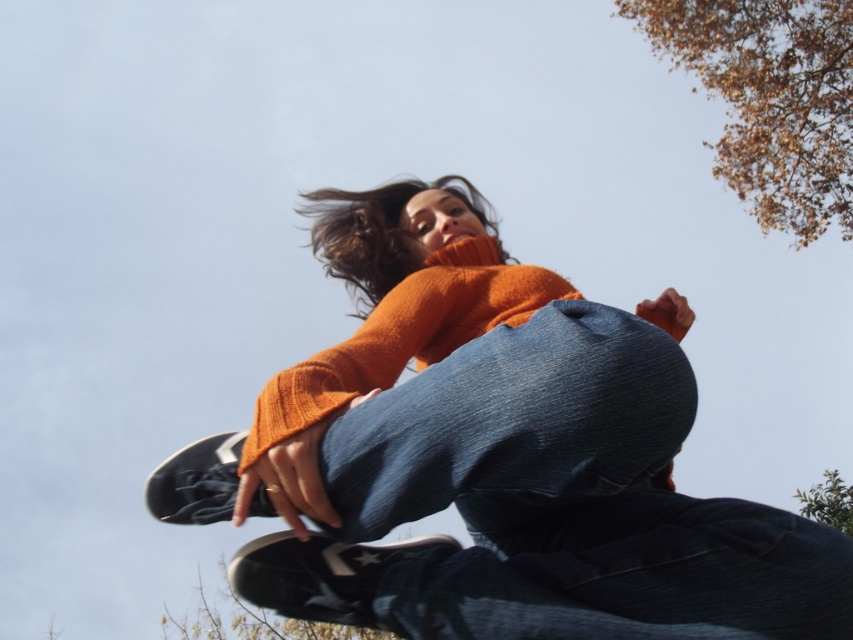
Which is in front, point (397, 486) or point (724, 140)?

Positioned in front is point (397, 486).

Is denim at center wider than brown leafy branches at upper right?

Incorrect, denim at center's width does not surpass brown leafy branches at upper right's.

At what (x,y) coordinates should I click in order to perform the action: click on denim at center. Please return your answer as a coordinate pair (x, y). Looking at the image, I should click on (514, 424).

Does point (367, 369) come closer to viewer compared to point (393, 637)?

Yes, it is.

Between point (402, 563) and point (276, 624), which one is positioned in front?

Point (402, 563) is more forward.

Identify the location of orange knitted sweater at center. The height and width of the screenshot is (640, 853). (492, 458).

Is orange knitted sweater at center taller than brown leafy branches at upper right?

No.

Does orange knitted sweater at center have a smaller size compared to brown leafy branches at upper right?

Correct, orange knitted sweater at center occupies less space than brown leafy branches at upper right.

This screenshot has width=853, height=640. I want to click on orange knitted sweater at center, so click(x=492, y=458).